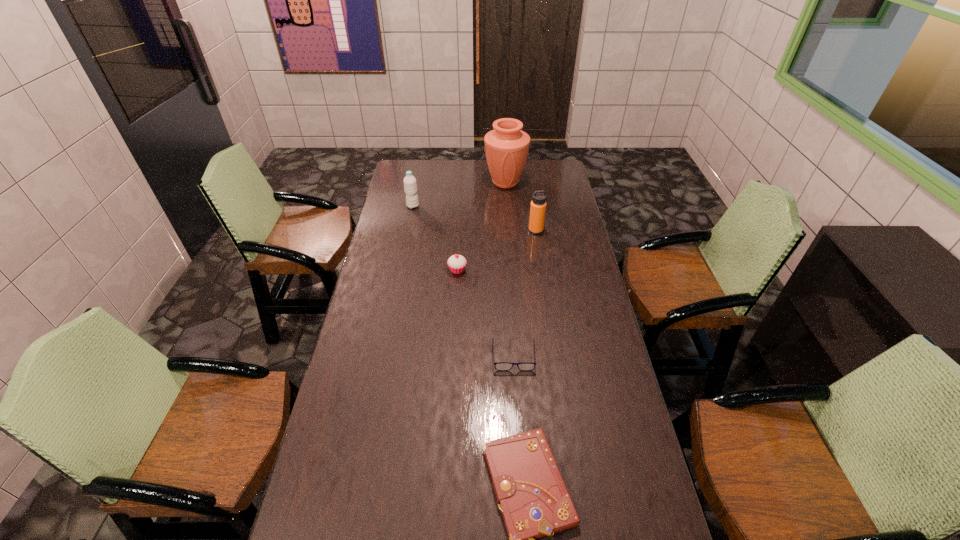
At what (x,y) coordinates should I click in order to perform the action: click on vase. Please return your answer as a coordinate pair (x, y). Looking at the image, I should click on (506, 147).

Identify the location of the farthest object. The image size is (960, 540). (506, 147).

Find the location of a particular element. The image size is (960, 540). thermos bottle is located at coordinates (538, 204).

Locate an element on the screen. water bottle is located at coordinates (410, 186).

Identify the location of the leftmost object. This screenshot has height=540, width=960. (410, 186).

The height and width of the screenshot is (540, 960). I want to click on cupcake, so click(x=456, y=263).

I want to click on the fourth farthest object, so click(456, 263).

Where is `the second nearest object`? the second nearest object is located at coordinates (500, 366).

At what (x,y) coordinates should I click in order to perform the action: click on vacant space positioned 0.100m on the back of the farthest object. Please return your answer as a coordinate pair (x, y). The width and height of the screenshot is (960, 540). Looking at the image, I should click on (504, 163).

The width and height of the screenshot is (960, 540). What are the coordinates of `free point located on the left of the thermos bottle` in the screenshot? It's located at (501, 231).